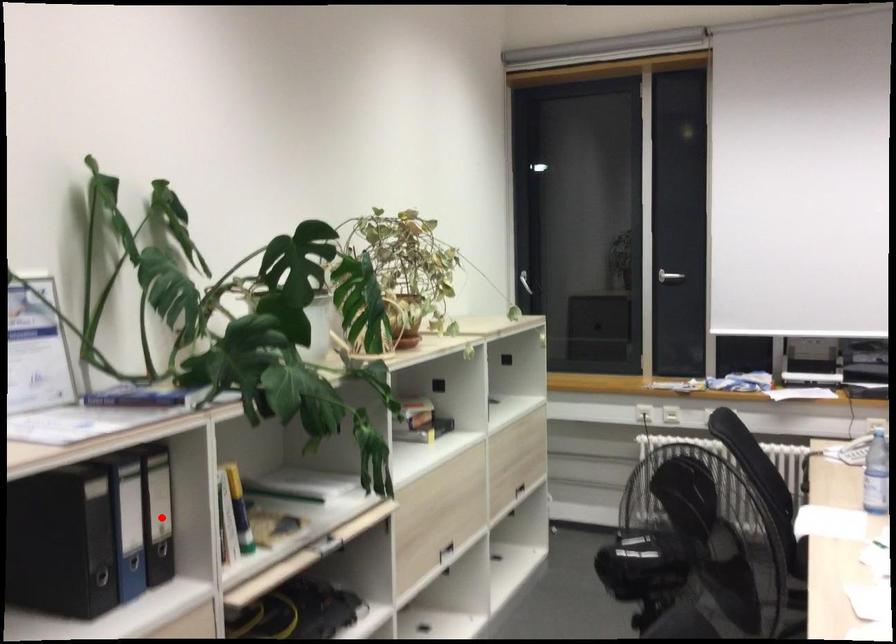
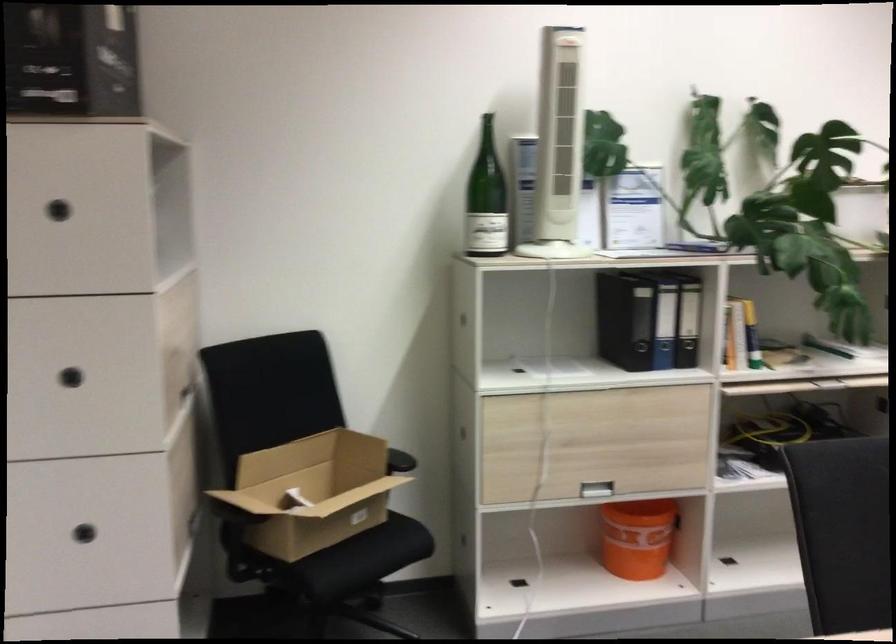
Question: A red point is marked in image1. In image2, is the corresponding 3D point closer to the camera or farther? Reply with the corresponding letter.

Choices:
 (A) The corresponding 3D point is closer.
 (B) The corresponding 3D point is farther.

Answer: (B)